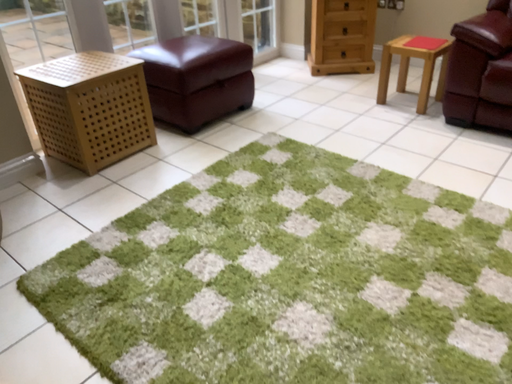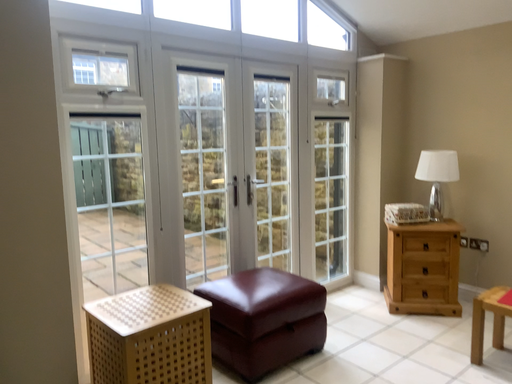
Question: How did the camera likely rotate when shooting the video?

Choices:
 (A) rotated right
 (B) rotated left

Answer: (B)